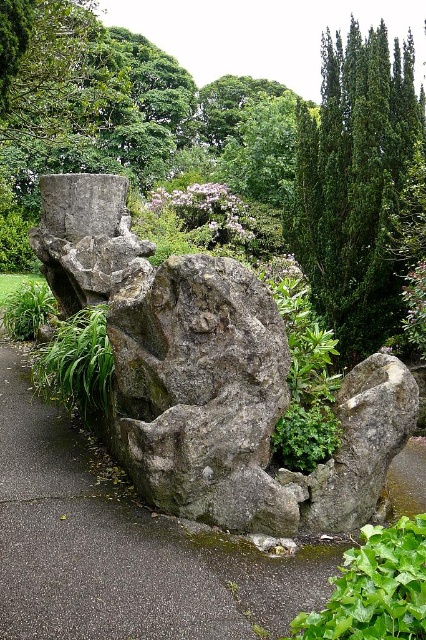
You are planning to place a small garden statue that is 1 meter wide on the gray stone path at center or near the green textured tree at upper right. Based on their sizes, where would be the better option?

The gray stone path at center has a larger size compared to the green textured tree at upper right, so placing the 1 meter wide garden statue on the gray stone path at center would be more appropriate as it has more space.

You are standing in the garden and want to plant a new flowerbed between the green textured tree at upper right and the green leafy bush at lower left. Which of the two plants has a narrower width to allow more space for the flowerbed?

The green textured tree at upper right is thinner than the green leafy bush at lower left, so it has a narrower width, allowing more space for the flowerbed.